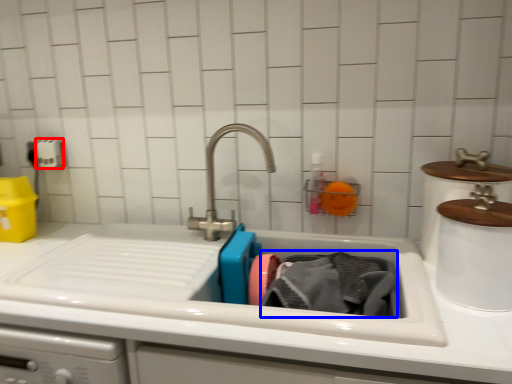
Question: Which object is closer to the camera taking this photo, toilet paper (highlighted by a red box) or clothing (highlighted by a blue box)?

Choices:
 (A) toilet paper
 (B) clothing

Answer: (B)